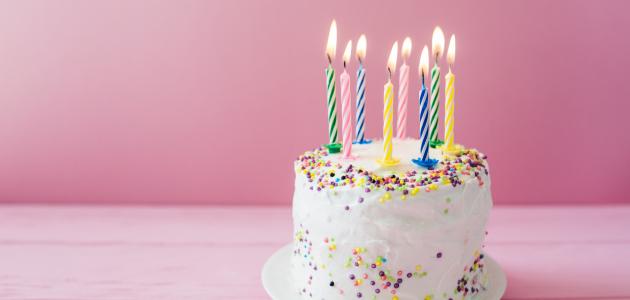
Find the location of a particular element. The height and width of the screenshot is (300, 630). candle flames is located at coordinates (329, 39), (344, 65), (365, 49), (392, 66), (406, 53), (427, 67), (438, 47), (450, 57).